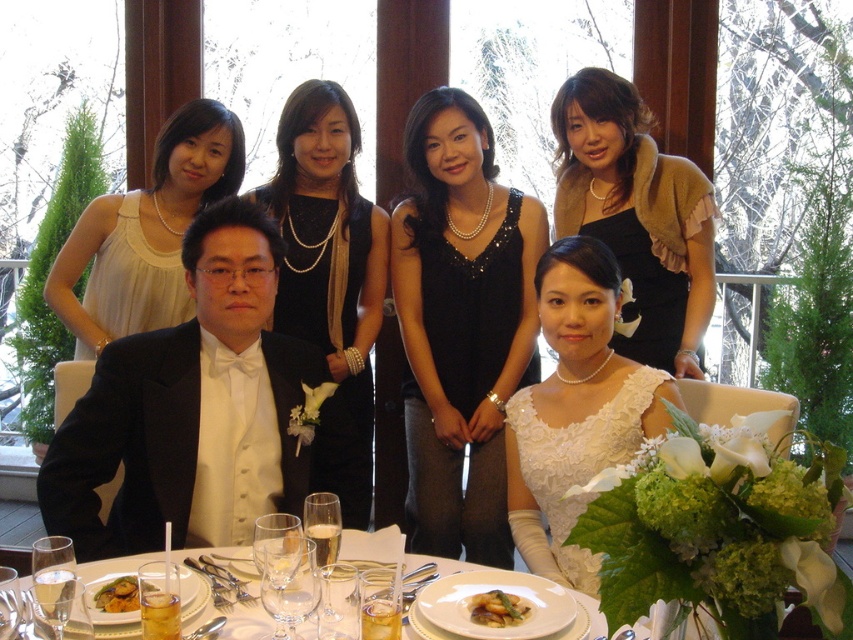
Does matte black dress at center appear on the right side of golden brown crispy fried food at center?

Correct, you'll find matte black dress at center to the right of golden brown crispy fried food at center.

Is matte black dress at center thinner than golden brown crispy fried food at center?

No, matte black dress at center is not thinner than golden brown crispy fried food at center.

You are a GUI agent. You are given a task and a screenshot of the screen. Output one action in this format:
    pyautogui.click(x=<x>, y=<y>)
    Task: Click on the matte black dress at center
    This screenshot has width=853, height=640.
    Given the screenshot: What is the action you would take?
    pyautogui.click(x=637, y=214)

Where is `matte black dress at center`? This screenshot has width=853, height=640. matte black dress at center is located at coordinates (637, 214).

Does matte black dress at center appear on the right side of white satin dress at upper left?

Correct, you'll find matte black dress at center to the right of white satin dress at upper left.

Who is more forward, (x=662, y=292) or (x=160, y=209)?

Positioned in front is point (x=662, y=292).

You are a GUI agent. You are given a task and a screenshot of the screen. Output one action in this format:
    pyautogui.click(x=<x>, y=<y>)
    Task: Click on the matte black dress at center
    This screenshot has width=853, height=640.
    Given the screenshot: What is the action you would take?
    pyautogui.click(x=637, y=214)

Does white lace dress at center appear on the left side of golden brown crispy fried food at center?

No, white lace dress at center is not to the left of golden brown crispy fried food at center.

Does point (606, 435) come behind point (523, 612)?

Yes, it is behind point (523, 612).

Measure the distance between white lace dress at center and camera.

The distance of white lace dress at center from camera is 5.64 feet.

This screenshot has height=640, width=853. Identify the location of white lace dress at center. (577, 461).